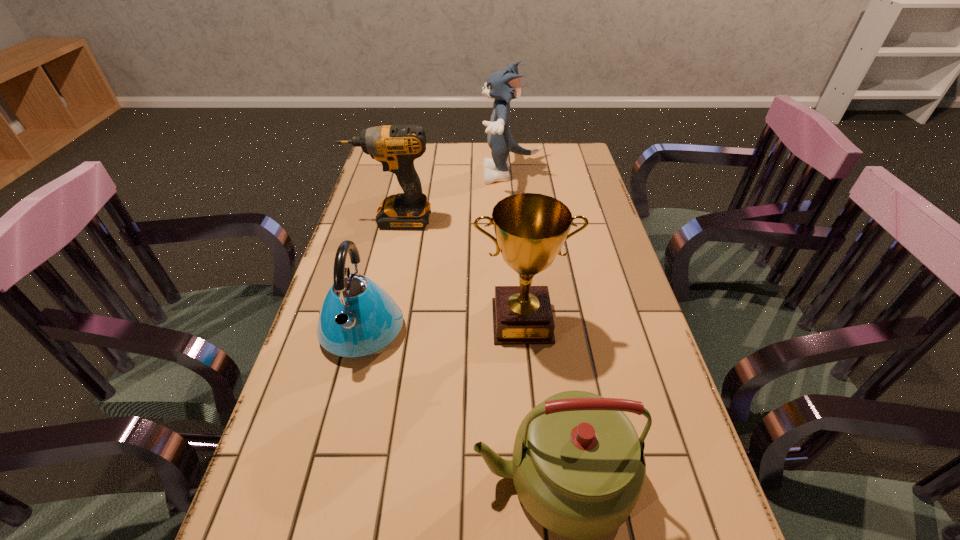
Where is `object that is at the far edge`? This screenshot has width=960, height=540. object that is at the far edge is located at coordinates (502, 86).

Image resolution: width=960 pixels, height=540 pixels. I want to click on drill that is positioned at the left edge, so click(x=396, y=146).

This screenshot has height=540, width=960. What are the coordinates of `kettle that is at the left edge` in the screenshot? It's located at (358, 319).

This screenshot has width=960, height=540. In order to click on free space at the far edge of the desktop in this screenshot , I will do `click(539, 157)`.

In order to click on vacant area at the left edge in this screenshot , I will do `click(386, 237)`.

Locate an element on the screen. vacant area at the right edge of the desktop is located at coordinates (593, 180).

Image resolution: width=960 pixels, height=540 pixels. I want to click on vacant space in between the award and the drill, so click(457, 271).

The image size is (960, 540). I want to click on free point between the cat and the fourth nearest object, so click(x=452, y=197).

Image resolution: width=960 pixels, height=540 pixels. What are the coordinates of `free space that is in between the tallest object and the drill` in the screenshot? It's located at (452, 197).

Identify the location of object that stands as the fourth closest to the farthest object. (578, 466).